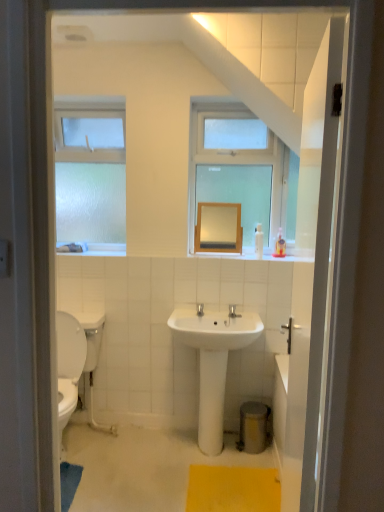
At what (x,y) coordinates should I click in order to perform the action: click on vacant space underneath white glossy sink at center (from a real-world perspective). Please return your answer as a coordinate pair (x, y). This screenshot has height=512, width=384. Looking at the image, I should click on (206, 454).